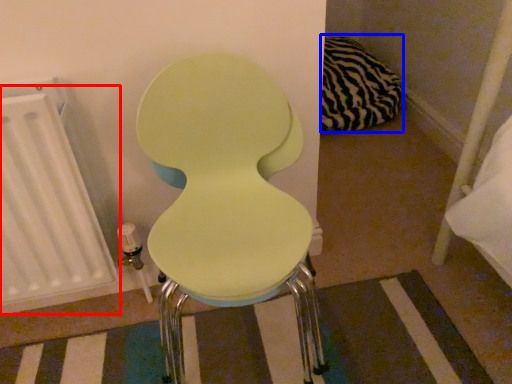
Question: Which object appears closest to the camera in this image, radiator (highlighted by a red box) or pillow (highlighted by a blue box)?

Choices:
 (A) radiator
 (B) pillow

Answer: (A)